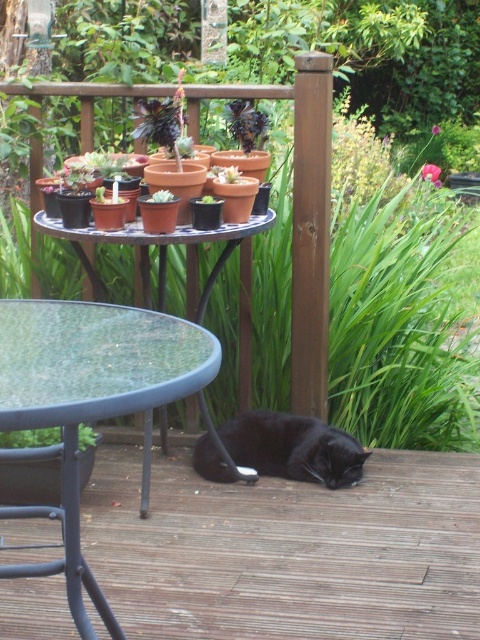
Question: Can you confirm if brown wooden deck at center is thinner than black matte cat at lower center?

Choices:
 (A) yes
 (B) no

Answer: (B)

Question: Among these points, which one is farthest from the camera?

Choices:
 (A) (124, 605)
 (B) (158, 332)
 (C) (225, 481)

Answer: (C)

Question: Is transparent glass table at lower left smaller than black matte cat at lower center?

Choices:
 (A) no
 (B) yes

Answer: (A)

Question: Which object is the farthest from the glassy transparent table at center?

Choices:
 (A) transparent glass table at lower left
 (B) brown wooden deck at center
 (C) black matte cat at lower center

Answer: (A)

Question: Can you confirm if brown wooden deck at center is positioned to the left of black matte cat at lower center?

Choices:
 (A) yes
 (B) no

Answer: (A)

Question: Which object is farther from the camera taking this photo?

Choices:
 (A) black matte cat at lower center
 (B) brown wooden deck at center
 (C) transparent glass table at lower left
 (D) glassy transparent table at center

Answer: (A)